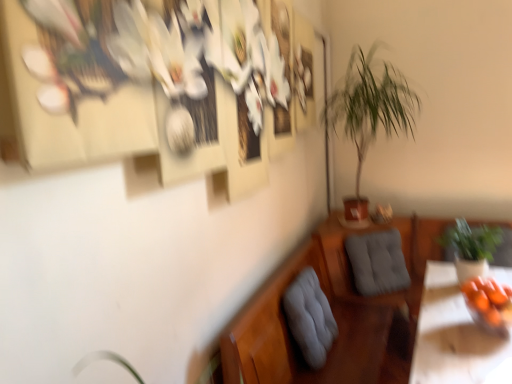
Question: From the image's perspective, is orange matte bowl at lower right beneath gray fabric cushion at lower center, which is the 1th swivel chair in front-to-back order?

Choices:
 (A) yes
 (B) no

Answer: (B)

Question: From a real-world perspective, is orange matte bowl at lower right positioned under gray fabric cushion at lower center, which is the 1th swivel chair in front-to-back order, based on gravity?

Choices:
 (A) no
 (B) yes

Answer: (A)

Question: Is gray fabric cushion at lower center, which ranks as the second swivel chair in back-to-front order, at the back of orange matte bowl at lower right?

Choices:
 (A) no
 (B) yes

Answer: (B)

Question: Does orange matte bowl at lower right come in front of gray fabric cushion at lower center, which is the 1th swivel chair in front-to-back order?

Choices:
 (A) yes
 (B) no

Answer: (A)

Question: Can you confirm if orange matte bowl at lower right is bigger than gray fabric cushion at lower center, the 1th swivel chair in the left-to-right sequence?

Choices:
 (A) yes
 (B) no

Answer: (B)

Question: Does orange matte bowl at lower right appear on the left side of gray fabric cushion at lower center, which is the 1th swivel chair in front-to-back order?

Choices:
 (A) yes
 (B) no

Answer: (B)

Question: From a real-world perspective, is gray fabric cushion at lower center, which is the 1th swivel chair in front-to-back order, located higher than orange matte bowl at lower right?

Choices:
 (A) yes
 (B) no

Answer: (B)

Question: Would you consider gray fabric cushion at lower center, arranged as the second swivel chair when viewed from the right, to be distant from orange matte bowl at lower right?

Choices:
 (A) yes
 (B) no

Answer: (B)

Question: Considering the relative sizes of gray fabric cushion at lower center, which ranks as the second swivel chair in back-to-front order, and orange matte bowl at lower right in the image provided, is gray fabric cushion at lower center, which ranks as the second swivel chair in back-to-front order, thinner than orange matte bowl at lower right?

Choices:
 (A) yes
 (B) no

Answer: (A)

Question: Is gray fabric cushion at lower center, arranged as the second swivel chair when viewed from the right, bigger than orange matte bowl at lower right?

Choices:
 (A) yes
 (B) no

Answer: (A)

Question: Is gray fabric cushion at lower center, which ranks as the second swivel chair in back-to-front order, oriented away from orange matte bowl at lower right?

Choices:
 (A) no
 (B) yes

Answer: (A)

Question: Is gray fabric cushion at lower center, the 1th swivel chair in the left-to-right sequence, positioned behind orange matte bowl at lower right?

Choices:
 (A) no
 (B) yes

Answer: (B)

Question: Is green leafy plant at center-right, arranged as the 2th houseplant when ordered from the bottom, at the right side of green leafy plant at right, marked as the 1th houseplant in a right-to-left arrangement?

Choices:
 (A) yes
 (B) no

Answer: (B)